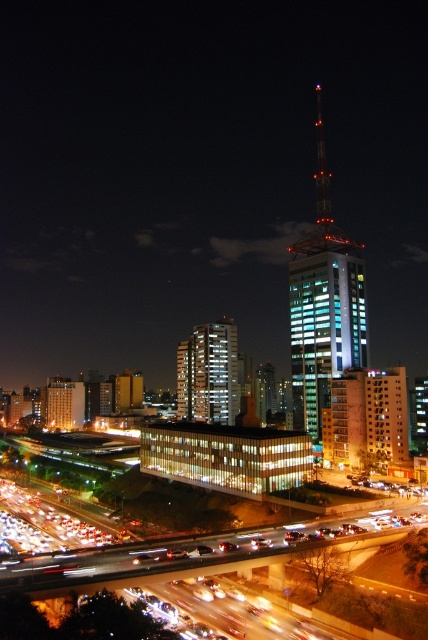
Question: Can you confirm if blue glass tower at center is positioned below metallic silver highway at bottom left?

Choices:
 (A) no
 (B) yes

Answer: (A)

Question: Which of the following is the closest to the observer?

Choices:
 (A) (350, 252)
 (B) (243, 547)

Answer: (B)

Question: From the image, what is the correct spatial relationship of metallic silver highway at bottom left in relation to white glass building at center?

Choices:
 (A) right
 (B) left

Answer: (A)

Question: Which of the following is the closest to the observer?

Choices:
 (A) (231, 422)
 (B) (74, 582)
 (C) (306, 330)

Answer: (B)

Question: Among these objects, which one is farthest from the camera?

Choices:
 (A) blue glass tower at center
 (B) white glass building at center
 (C) metallic silver highway at bottom left

Answer: (B)

Question: Is metallic silver highway at bottom left above white glass building at center?

Choices:
 (A) no
 (B) yes

Answer: (A)